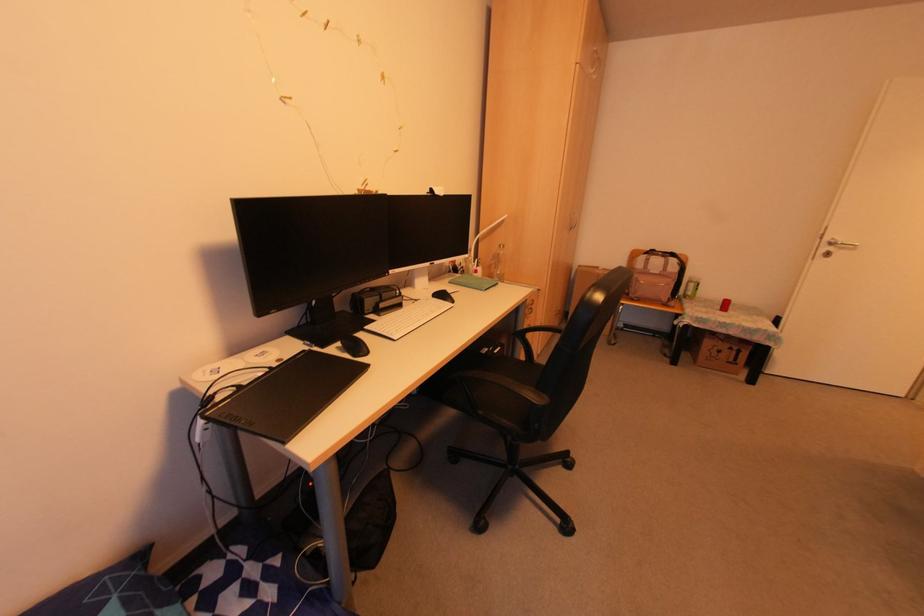
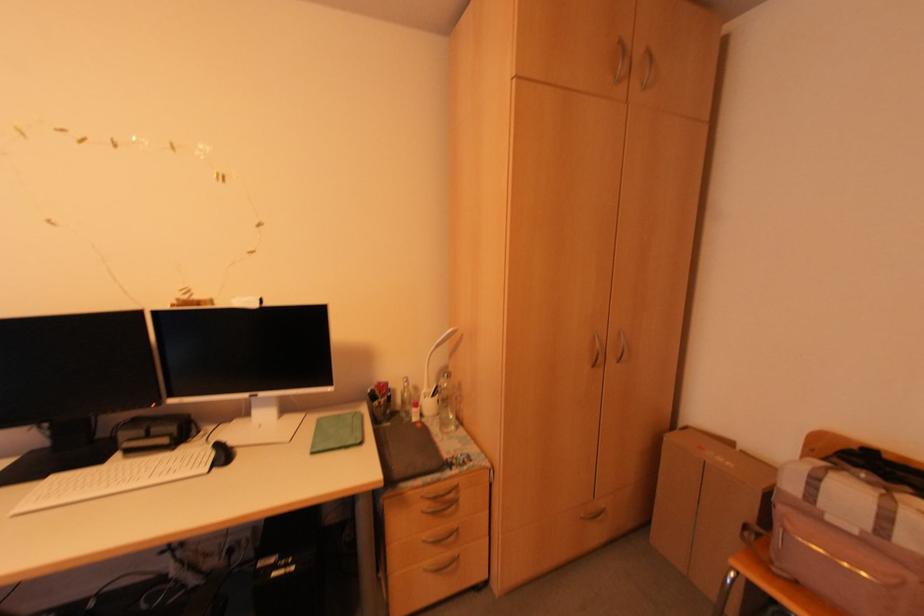
The point at (655,273) is marked in the first image. Where is the corresponding point in the second image?

(854, 532)